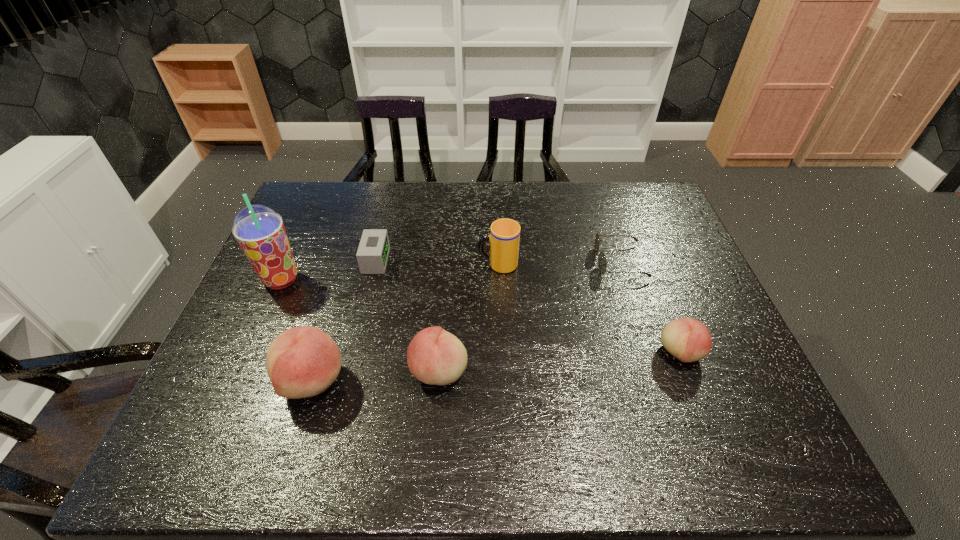
I want to click on free space located 0.090m on the back of the tallest object, so click(297, 245).

In order to click on peach present at the left edge in this screenshot , I will do `click(301, 362)`.

Locate an element on the screen. The height and width of the screenshot is (540, 960). smoothie situated at the left edge is located at coordinates (259, 230).

This screenshot has height=540, width=960. In order to click on peach present at the right edge in this screenshot , I will do `click(688, 340)`.

Where is `sunglasses that is at the right edge`? Image resolution: width=960 pixels, height=540 pixels. sunglasses that is at the right edge is located at coordinates (602, 264).

Find the location of a particular element. The width and height of the screenshot is (960, 540). object that is at the near left corner is located at coordinates (301, 362).

This screenshot has height=540, width=960. In the image, there is a desktop. Identify the location of vacant space at the far edge. (508, 181).

The height and width of the screenshot is (540, 960). Identify the location of vacant space at the near edge of the desktop. coord(679,381).

Where is `vacant space at the right edge of the desktop`? This screenshot has width=960, height=540. vacant space at the right edge of the desktop is located at coordinates (701, 362).

This screenshot has width=960, height=540. I want to click on vacant space at the far left corner of the desktop, so click(x=339, y=190).